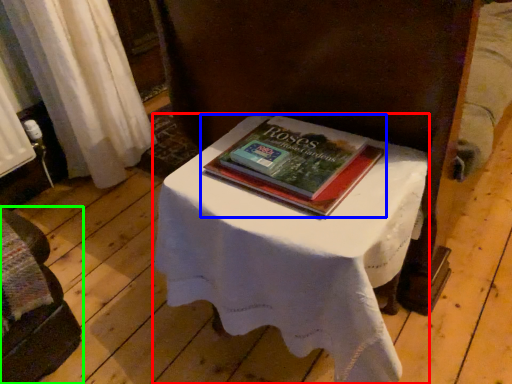
Question: Considering the real-world distances, which object is farthest from table (highlighted by a red box)? book (highlighted by a blue box) or furniture (highlighted by a green box)?

Choices:
 (A) book
 (B) furniture

Answer: (B)